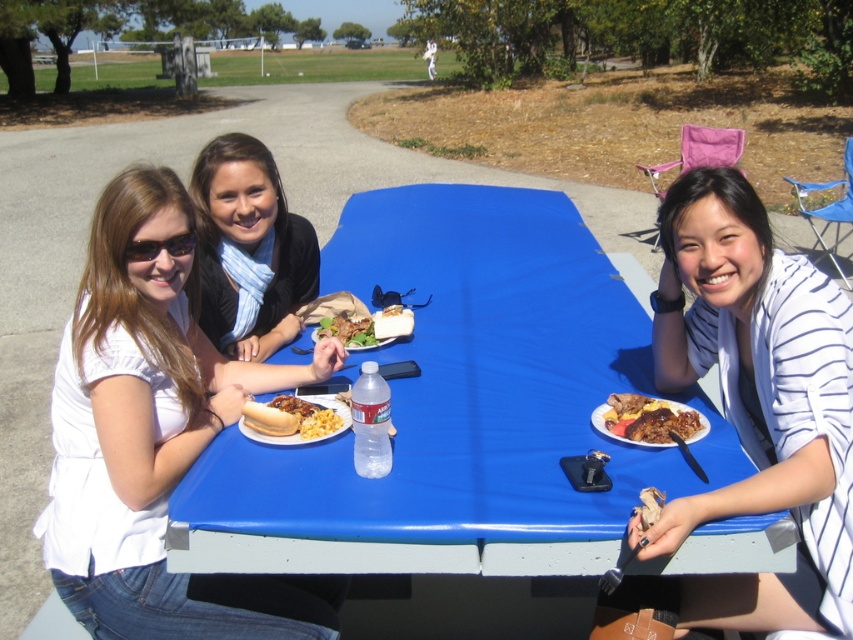
Question: Which of these objects is positioned closest to the yellowish matte macaroni at center?

Choices:
 (A) brown glossy meat at right
 (B) grilled meat at center
 (C) white matte shirt at left
 (D) white striped shirt at upper right

Answer: (C)

Question: Does white striped shirt at upper right have a larger size compared to grilled meat at center?

Choices:
 (A) no
 (B) yes

Answer: (B)

Question: In this image, where is white striped shirt at upper right located relative to blue striped scarf at center?

Choices:
 (A) right
 (B) left

Answer: (A)

Question: Which object is the closest to the yellowish matte macaroni at center?

Choices:
 (A) golden crispy fries at center
 (B) golden crispy hot dog bun at center

Answer: (B)

Question: Which object is farther from the camera taking this photo?

Choices:
 (A) blue plastic table at center
 (B) matte plastic plate at center
 (C) white striped shirt at upper right

Answer: (B)

Question: Does white matte shirt at left have a greater width compared to white striped shirt at upper right?

Choices:
 (A) no
 (B) yes

Answer: (B)